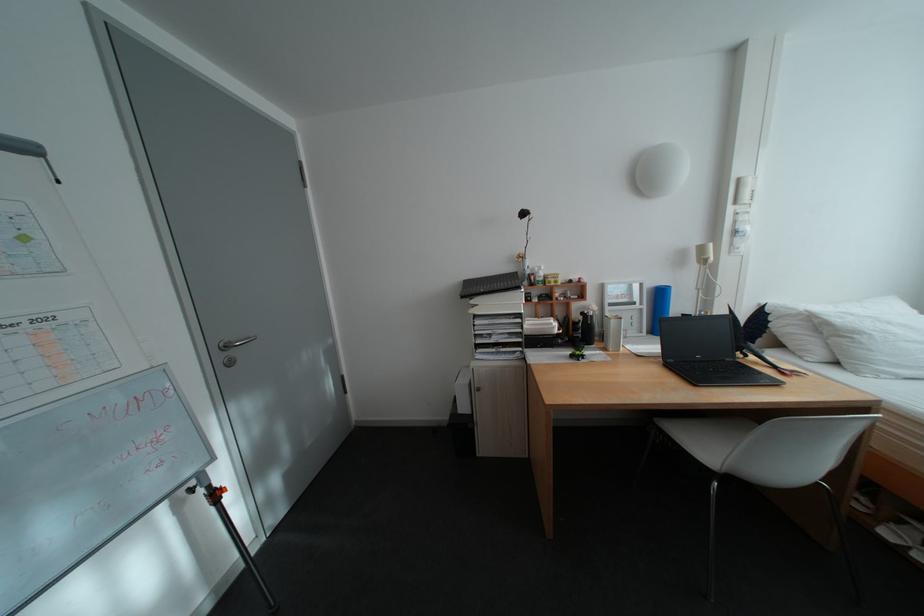
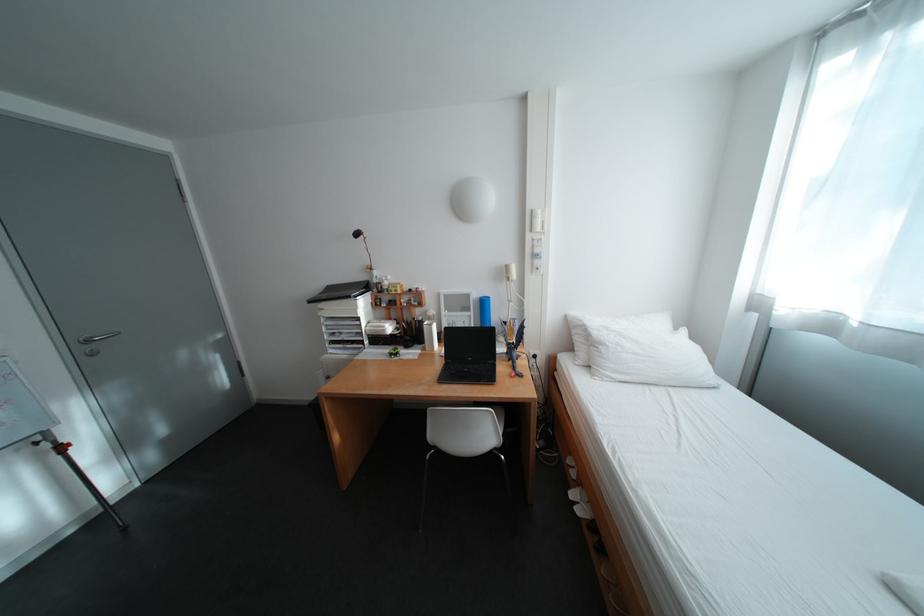
Find the pixel in the second image that matches point (211, 488) in the first image.

(55, 444)